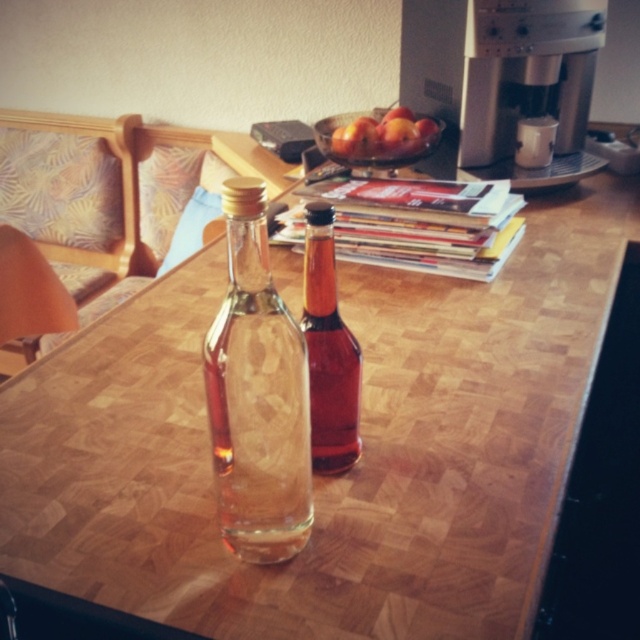
You are a chef trying to place a 4.5 inch wide cutting board between the clear glass bottle at center and the translucent glass bottle at center on the table. Will there be enough space?

The clear glass bottle at center and the translucent glass bottle at center are 4.15 inches apart from each other. Since the cutting board is 4.5 inches wide, it will not fit between them as the space is slightly smaller than the board.

You are setting up a small breakfast table and need to place both the silver metallic coffee machine at upper right and the smooth red apples at center. Which item should you place first if you want to ensure there is enough vertical space for both?

You should place the silver metallic coffee machine at upper right first because it has a greater height compared to the smooth red apples at center, ensuring there is enough vertical space when arranging both items.

You are organizing a small party and need to pour drinks into cups. You have two bottles on the table. The clear glass bottle at center contains water, and the translucent glass bottle at center has a syrup. Which bottle should you use to fill the cups if you want to pour the syrup first?

The translucent glass bottle at center contains the syrup and should be used first to pour the syrup into the cups before adding water from the clear glass bottle at center.